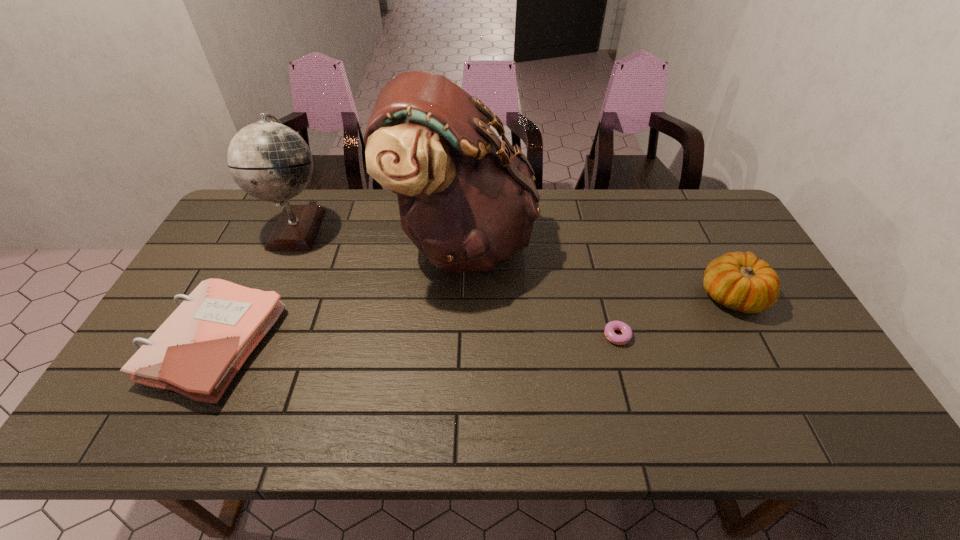
Identify the location of satchel. This screenshot has width=960, height=540. (467, 200).

This screenshot has width=960, height=540. I want to click on the tallest object, so click(467, 200).

This screenshot has width=960, height=540. I want to click on globe, so click(x=268, y=160).

I want to click on gourd, so click(x=739, y=281).

The height and width of the screenshot is (540, 960). I want to click on the third tallest object, so click(x=739, y=281).

Where is `phonebook`? This screenshot has height=540, width=960. phonebook is located at coordinates (198, 350).

I want to click on the fourth object from left to right, so click(x=610, y=327).

Find the location of a particular element. doughnut is located at coordinates (610, 327).

Identify the location of vacant space located 0.350m at the front of the satchel with buckles. The width and height of the screenshot is (960, 540). (643, 241).

What are the coordinates of `vacant space located at the equator of the second tallest object` in the screenshot? It's located at (359, 227).